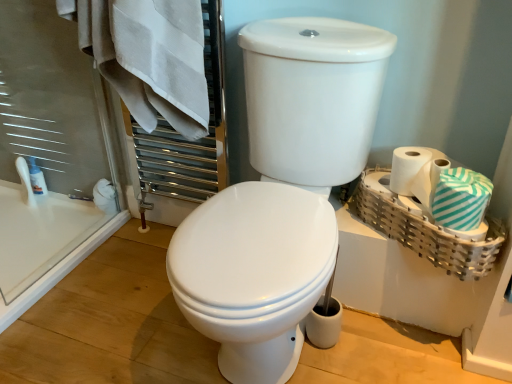
Question: Is white glossy toilet at center taller or shorter than white cotton towel at upper left, the second bath towel from the right?

Choices:
 (A) short
 (B) tall

Answer: (B)

Question: Is white glossy toilet at center inside or outside of white cotton towel at upper left, positioned as the 1th bath towel in left-to-right order?

Choices:
 (A) outside
 (B) inside

Answer: (A)

Question: Estimate the real-world distances between objects in this image. Which object is closer to the white glossy lotion at left?

Choices:
 (A) white matte toilet paper at right
 (B) bamboo woven basket at right
 (C) white glossy toilet at center
 (D) white cotton towel at upper left, which appears as the 1th bath towel when viewed from the top
 (E) teal striped fabric at right, which ranks as the 1th bath towel in right-to-left order

Answer: (D)

Question: Estimate the real-world distances between objects in this image. Which object is closer to the white matte toilet paper at right?

Choices:
 (A) teal striped fabric at right, positioned as the second bath towel in left-to-right order
 (B) bamboo woven basket at right
 (C) white cotton towel at upper left, positioned as the 1th bath towel in left-to-right order
 (D) white glossy lotion at left
 (E) white glossy toilet at center

Answer: (A)